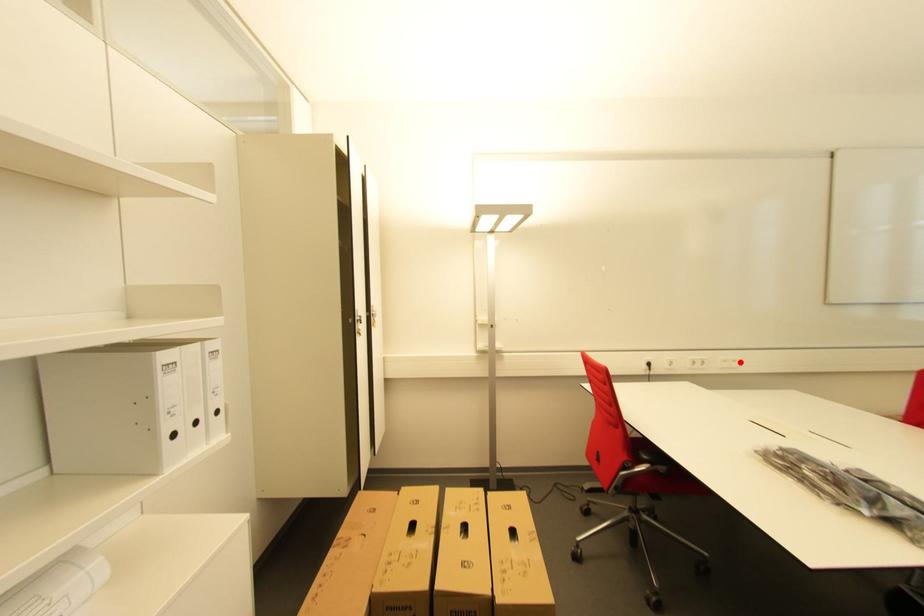
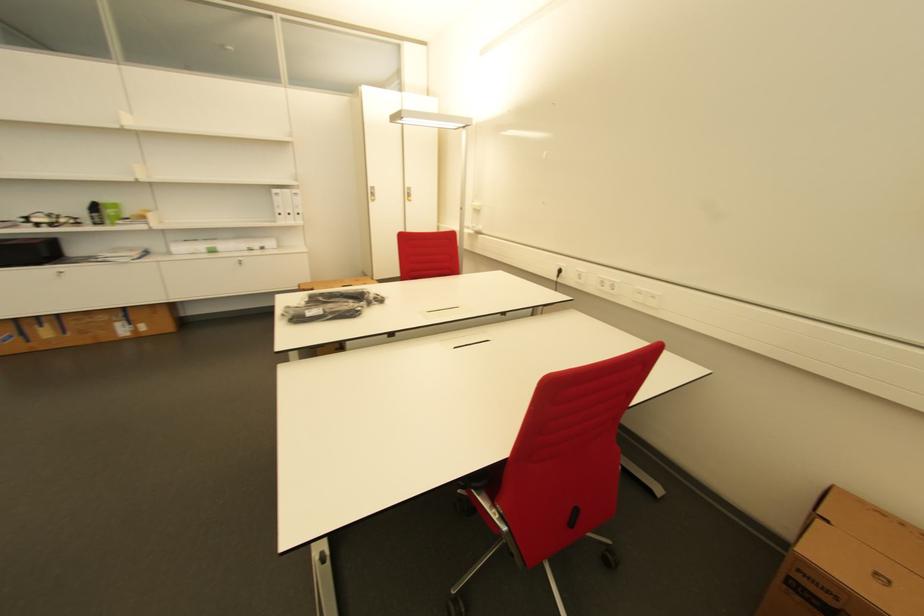
The point at the highlighted location is marked in the first image. Where is the corresponding point in the second image?

(659, 299)